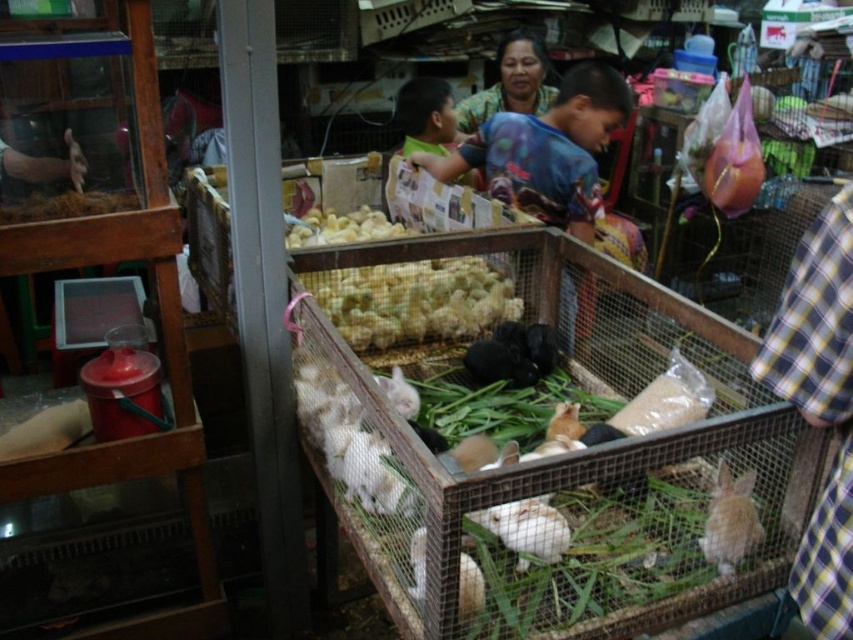
You are a customer at the market and want to approach both the blue printed shirt at center and the green plaid shirt at upper center. If you start at the entrance, which shirt should you walk towards first to minimize the distance you have to cover?

The blue printed shirt at center is closer to the entrance than the green plaid shirt at upper center, so you should walk towards the blue printed shirt at center first to minimize the distance.

You are a customer at the market and want to buy a shirt. You see the blue printed shirt at center and the green plaid shirt at upper center. Which shirt is bigger in size?

The blue printed shirt at center is larger in size compared to the green plaid shirt at upper center.

Consider the image. You are standing in the market scene and want to locate the point at coordinates (463, 120). Is this point closer to you or farther away than 3 meters?

The point at coordinates (463, 120) is 3.33 meters from the camera, so it is farther away than 3 meters.